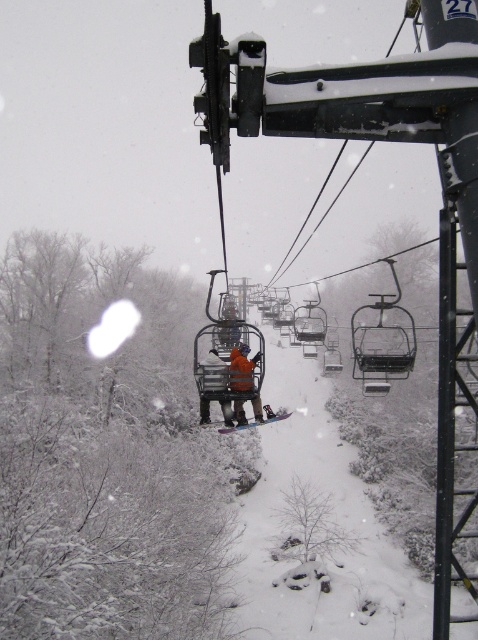
You are a photographer trying to capture a clear photo of both the orange fleece jacket at center and the orange fabric jacket at center on the ski lift chair. Since the jackets are similar in color, which one would you focus on first to ensure the smaller one is in sharp focus?

The orange fleece jacket at center is smaller in size compared to the orange fabric jacket at center, so you should focus on the orange fleece jacket at center first to ensure it is in sharp focus.

You are standing at the base of the ski lift and want to locate the orange fleece jacket at center. According to the coordinates provided, where would you look relative to the center of the image?

The orange fleece jacket at center is located at coordinates point (241, 368), which is slightly to the right and just below the center of the image.